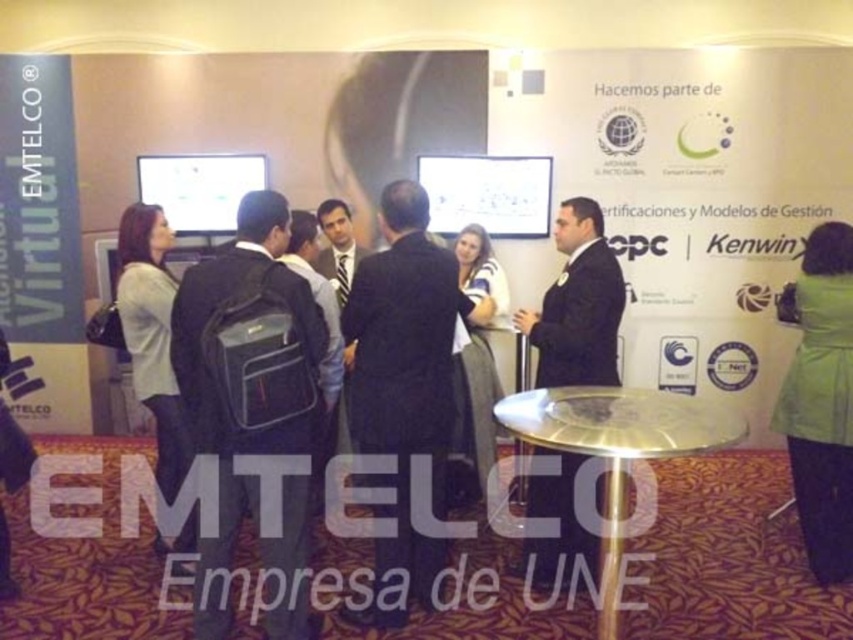
Is green fabric coat at lower right further to camera compared to dark blue dress at center?

No, it is in front of dark blue dress at center.

Does point (798, 492) lie behind point (474, 291)?

That is False.

The height and width of the screenshot is (640, 853). Identify the location of green fabric coat at lower right. (821, 397).

Does black fabric backpack at center come in front of dark blue dress at center?

That is True.

Does black fabric backpack at center appear under dark blue dress at center?

Correct, black fabric backpack at center is located below dark blue dress at center.

At what (x,y) coordinates should I click in order to perform the action: click on black fabric backpack at center. Please return your answer as a coordinate pair (x, y). Looking at the image, I should click on (244, 380).

Between green fabric coat at lower right and matte gray blazer at left, which one is positioned lower?

Positioned lower is green fabric coat at lower right.

Is green fabric coat at lower right thinner than matte gray blazer at left?

Indeed, green fabric coat at lower right has a lesser width compared to matte gray blazer at left.

Identify the location of green fabric coat at lower right. (821, 397).